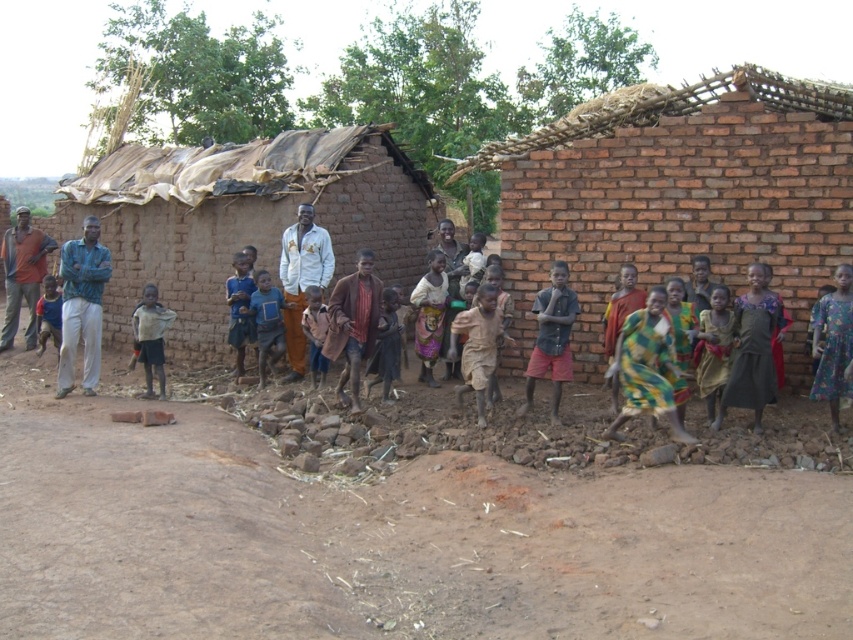
You are standing in the rural village scene described. There are two points marked in the image, one at coordinates point [376,509] and another at point [347,314]. Which of these two points is nearer to your current position?

Point [376,509] is closer to the camera than point [347,314], so the point at coordinates point [376,509] is nearer to your current position.

You are standing at the edge of the village and want to reach both the brown mud hut at center and the green and yellow fabric dress at center. Which object is closer to you?

The brown mud hut at center and the green and yellow fabric dress at center are both at the same distance from you since they are both located at the center of the image.